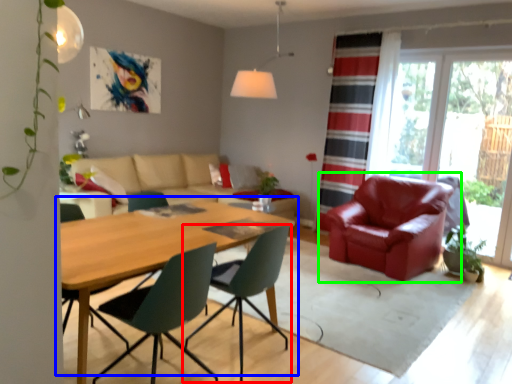
Question: Which object is positioned farthest from chair (highlighted by a red box)? Select from kitchen & dining room table (highlighted by a blue box) and chair (highlighted by a green box).

Choices:
 (A) kitchen & dining room table
 (B) chair

Answer: (B)